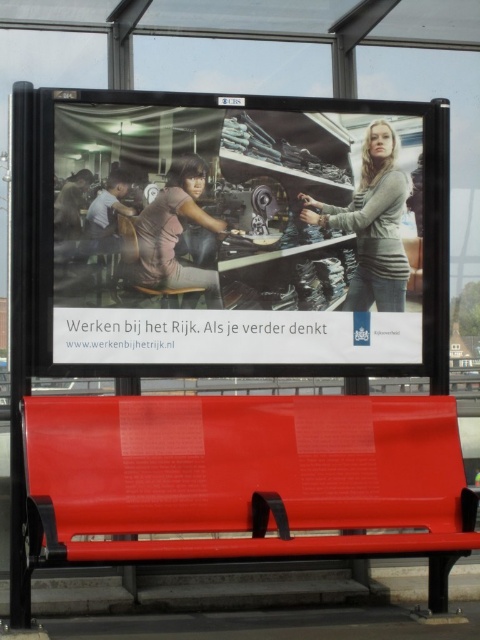
You are standing at the bus stop and notice the advertisement above the red bench. Can you see the gray sweater at center from your current position?

Yes, the gray sweater at center is located at point (372, 224) on the advertisement, which is within the visible area from the bus stop.

You are at the bus stop and see the metallic red bench at center and the gray sweater at center. Which object is positioned to the left when facing the bus stop?

The metallic red bench at center is to the left of the gray sweater at center.